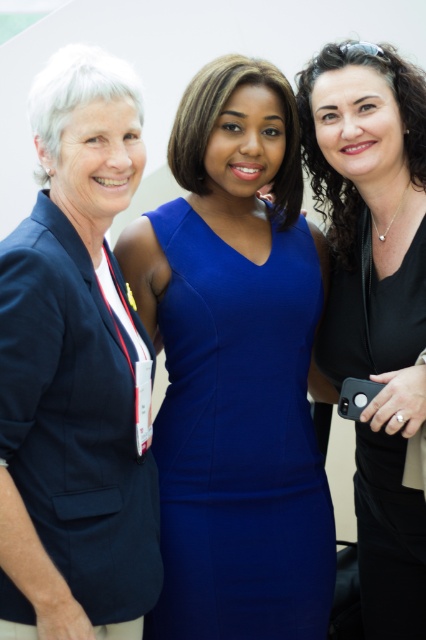
Is royal blue jersey dress at center thinner than black matte dress at center?

In fact, royal blue jersey dress at center might be wider than black matte dress at center.

Is point (155, 438) closer to viewer compared to point (316, 131)?

Yes, point (155, 438) is in front of point (316, 131).

The image size is (426, 640). In order to click on royal blue jersey dress at center in this screenshot , I will do [239, 440].

Which is in front, point (85, 371) or point (394, 266)?

Positioned in front is point (85, 371).

Who is more distant from viewer, [120,120] or [331,374]?

Positioned behind is point [331,374].

Where is `matte black blazer at left`? matte black blazer at left is located at coordinates (77, 372).

Is matte black blazer at left thinner than royal blue jersey dress at center?

Yes, matte black blazer at left is thinner than royal blue jersey dress at center.

Which is more to the right, matte black blazer at left or royal blue jersey dress at center?

Positioned to the right is royal blue jersey dress at center.

Based on the photo, measure the distance between point (115, 467) and camera.

Point (115, 467) is 5.08 feet away from camera.

Where is `matte black blazer at left`? This screenshot has width=426, height=640. matte black blazer at left is located at coordinates (77, 372).